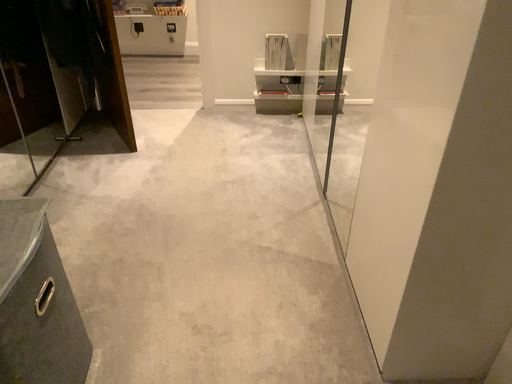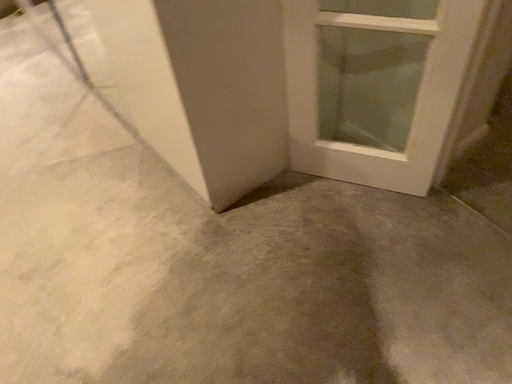
Question: How did the camera likely rotate when shooting the video?

Choices:
 (A) rotated right
 (B) rotated left

Answer: (A)